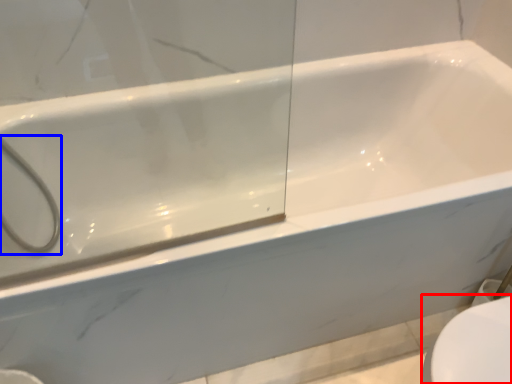
Question: Which object is closer to the camera taking this photo, toilet bowl (highlighted by a red box) or shower (highlighted by a blue box)?

Choices:
 (A) toilet bowl
 (B) shower

Answer: (A)